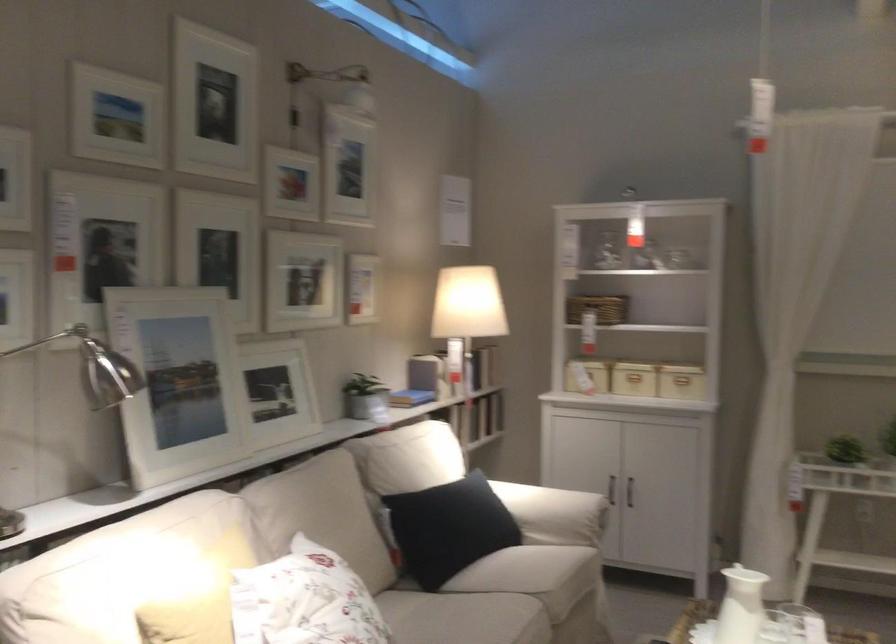
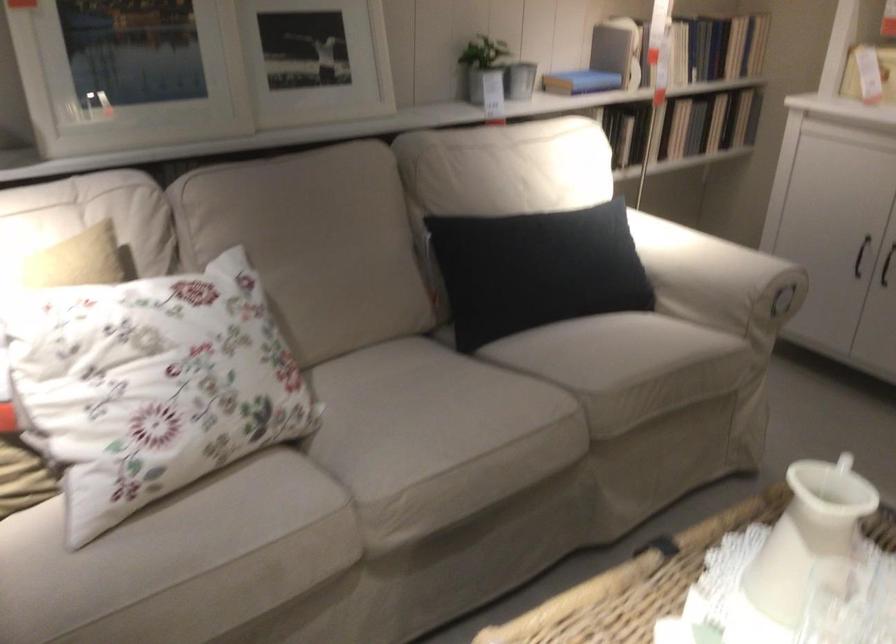
Where in the second image is the point corresponding to pixel 621 491 from the first image?

(860, 256)